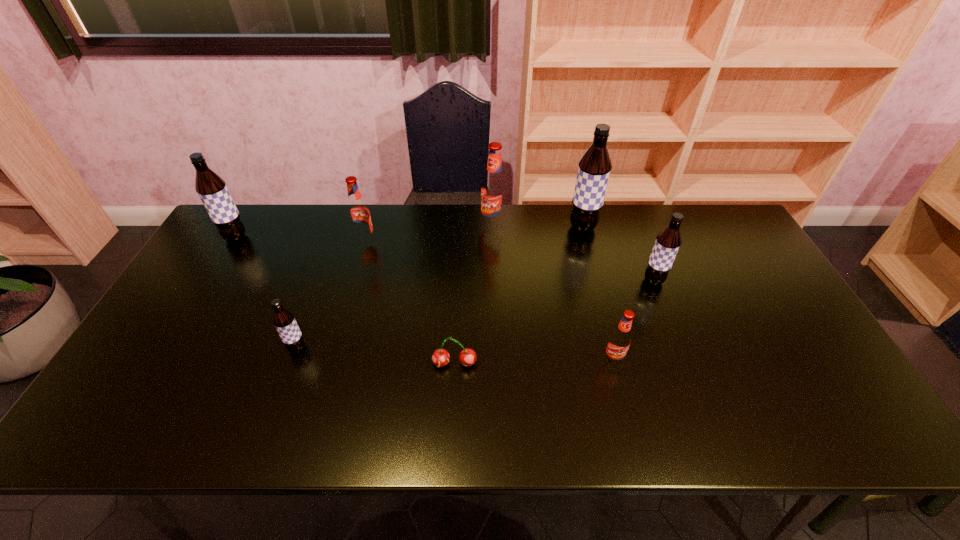
The height and width of the screenshot is (540, 960). Find the location of `free space at the far left corner of the desktop`. free space at the far left corner of the desktop is located at coordinates (269, 218).

Identify the location of free space between the leftmost object and the fourth object from left to right. Image resolution: width=960 pixels, height=540 pixels. (345, 300).

Where is `free spot between the fifth root beer from right to left and the biggest red root beer`? free spot between the fifth root beer from right to left and the biggest red root beer is located at coordinates (429, 233).

Locate an element on the screen. This screenshot has width=960, height=540. free space between the third root beer from left to right and the rightmost brown root beer is located at coordinates (510, 261).

You are a GUI agent. You are given a task and a screenshot of the screen. Output one action in this format:
    pyautogui.click(x=<x>, y=<y>)
    Task: Click on the vacant area that lies between the nearest brown root beer and the second nearest red root beer
    The width and height of the screenshot is (960, 540).
    Given the screenshot: What is the action you would take?
    pyautogui.click(x=331, y=295)

Locate an element on the screen. free area in between the rightmost red root beer and the third brown root beer from left to right is located at coordinates (598, 293).

The image size is (960, 540). Identify the location of vacant area between the fifth root beer from right to left and the sixth root beer from right to left. pyautogui.click(x=331, y=295).

This screenshot has width=960, height=540. Identify the location of vacant area that lies between the second biggest red root beer and the tallest object. (474, 234).

You are a GUI agent. You are given a task and a screenshot of the screen. Output one action in this format:
    pyautogui.click(x=<x>, y=<y>)
    Task: Click on the free spot between the tallest root beer and the fifth object from right to left
    
    Given the screenshot: What is the action you would take?
    coord(518,295)

You are a GUI agent. You are given a task and a screenshot of the screen. Output one action in this format:
    pyautogui.click(x=<x>, y=<y>)
    Task: Click on the vacant space in between the third smallest brown root beer and the rightmost brown root beer
    
    Given the screenshot: What is the action you would take?
    pyautogui.click(x=444, y=259)